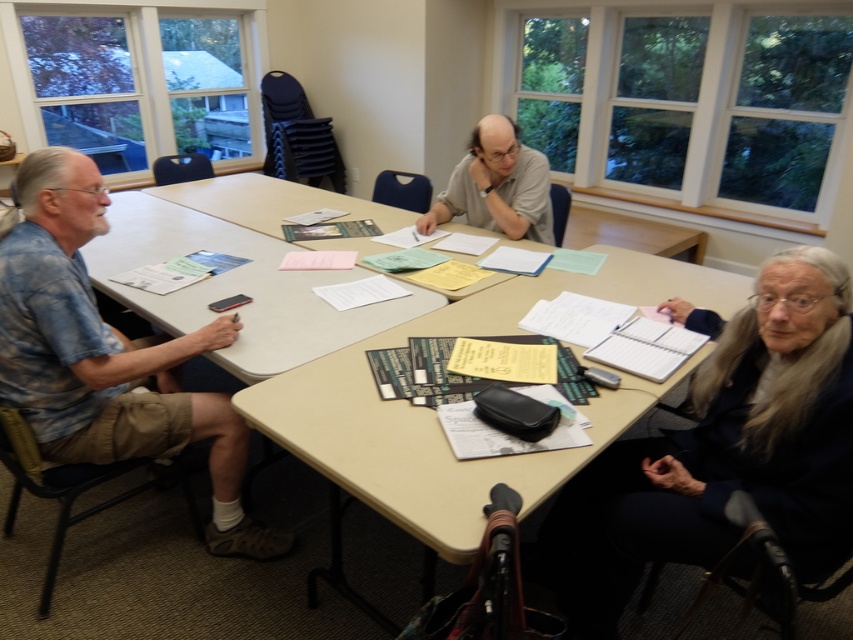
Question: Observing the image, what is the correct spatial positioning of dark blue sweater at lower right in reference to blue tie-dye shirt at left?

Choices:
 (A) right
 (B) left

Answer: (A)

Question: Which of the following is the closest to the observer?

Choices:
 (A) (498, 129)
 (B) (15, 292)

Answer: (B)

Question: Can you confirm if dark blue sweater at lower right is positioned to the left of matte gray shirt at center?

Choices:
 (A) yes
 (B) no

Answer: (B)

Question: Does dark blue sweater at lower right appear on the right side of blue tie-dye shirt at left?

Choices:
 (A) no
 (B) yes

Answer: (B)

Question: Which of the following is the farthest from the observer?

Choices:
 (A) dark blue sweater at lower right
 (B) matte gray shirt at center
 (C) blue tie-dye shirt at left

Answer: (B)

Question: Which object appears farthest from the camera in this image?

Choices:
 (A) matte gray shirt at center
 (B) blue tie-dye shirt at left

Answer: (A)